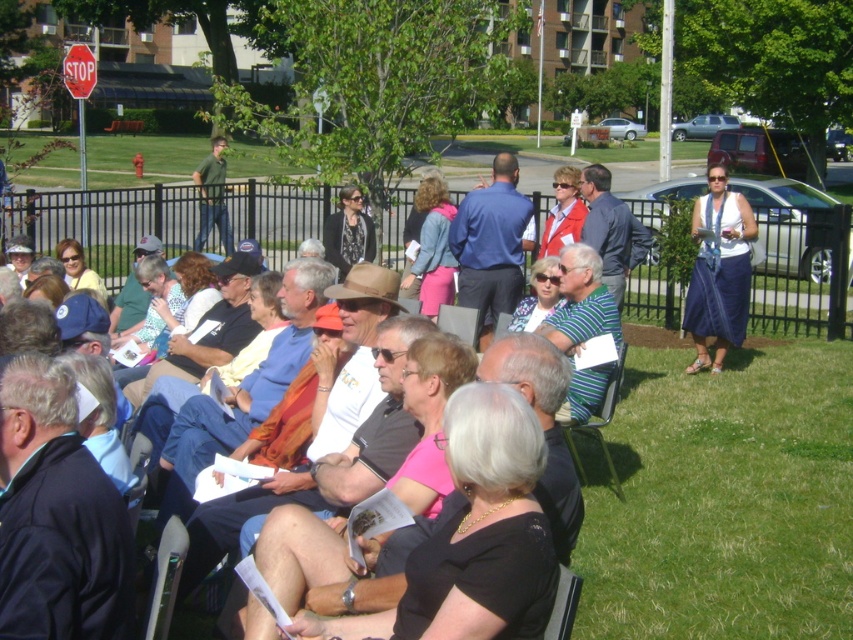
Between green grass at lower right and striped fabric chair at center, which one has more height?

striped fabric chair at center is taller.

Between green grass at lower right and striped fabric chair at center, which one is positioned higher?

striped fabric chair at center is higher up.

Which is behind, point (827, 522) or point (614, 484)?

Positioned behind is point (614, 484).

Where is `green grass at lower right`? This screenshot has width=853, height=640. green grass at lower right is located at coordinates (722, 499).

Can you confirm if green casual shirt at center is thinner than metallic red stop sign at upper left?

Indeed, green casual shirt at center has a lesser width compared to metallic red stop sign at upper left.

Does green casual shirt at center appear under metallic red stop sign at upper left?

Yes.

Which is behind, point (219, 214) or point (83, 72)?

Point (83, 72)

What are the coordinates of `green casual shirt at center` in the screenshot? It's located at (212, 196).

Between point (695, 368) and point (67, 83), which one is positioned behind?

Point (67, 83)

Is denim skirt at right shorter than metallic red stop sign at upper left?

In fact, denim skirt at right may be taller than metallic red stop sign at upper left.

I want to click on denim skirt at right, so click(x=718, y=269).